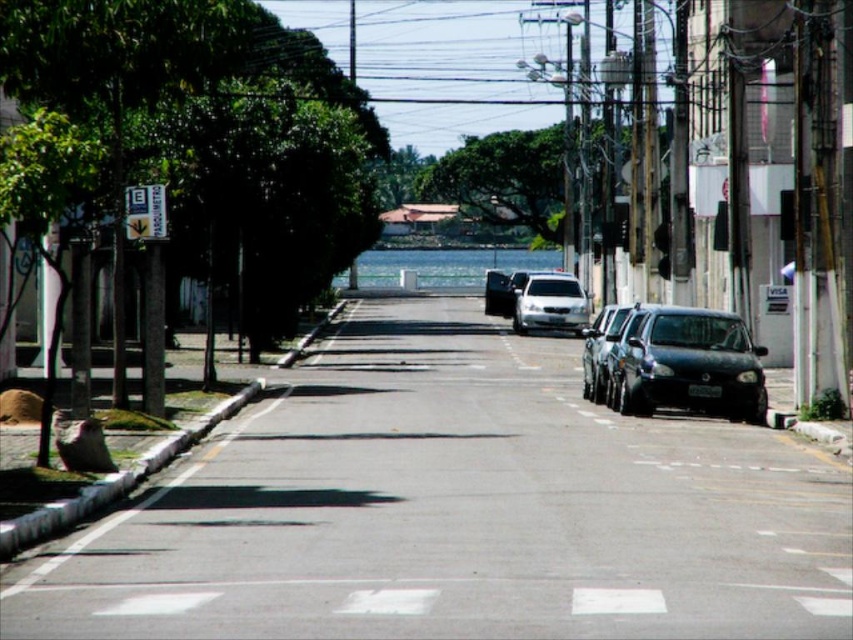
Can you confirm if shiny black sedan at center right is bigger than shiny silver sedan at center?

No.

Consider the image. Who is more distant from viewer, (604,308) or (490,296)?

The point (490,296) is behind.

Identify the location of shiny black sedan at center right. This screenshot has height=640, width=853. (601, 349).

Can you confirm if white matte car at center is positioned to the left of shiny silver sedan at center?

In fact, white matte car at center is to the right of shiny silver sedan at center.

Is point (523, 284) in front of point (505, 292)?

Yes, point (523, 284) is closer to viewer.

You are a GUI agent. You are given a task and a screenshot of the screen. Output one action in this format:
    pyautogui.click(x=<x>, y=<y>)
    Task: Click on the white matte car at center
    
    Given the screenshot: What is the action you would take?
    pyautogui.click(x=550, y=304)

Consider the image. Does white matte car at center lie behind shiny black sedan at center right?

Yes, it is behind shiny black sedan at center right.

Which is more to the left, white matte car at center or shiny black sedan at center right?

shiny black sedan at center right

Locate an element on the screen. white matte car at center is located at coordinates (550, 304).

At what (x,y) coordinates should I click in order to perform the action: click on white matte car at center. Please return your answer as a coordinate pair (x, y). Looking at the image, I should click on (550, 304).